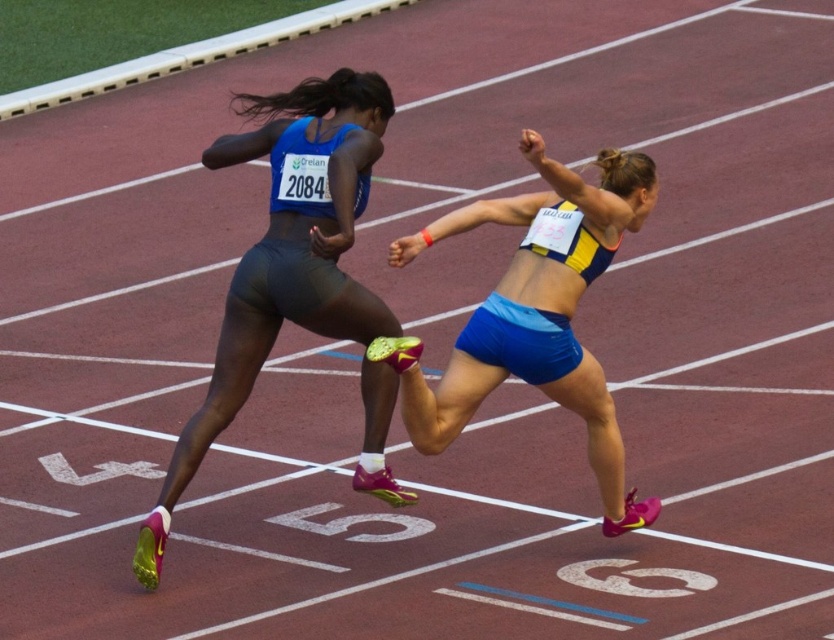
You are a photographer standing at the starting line of the track. You want to capture a photo of the athlete wearing the blue sports bra with the number 2084 pinned to her back. The camera you are using has a focal length of 50mm. Given that the athlete is at point (312,179), which is 8.23 meters away from you, what is the approximate angle of view required to ensure the athlete fits entirely within the frame?

The athlete wearing the blue sports bra with the number 2084 pinned to her back is at point (312,179) and 8.23 meters away from the photographer. To calculate the angle of view, use the formula angle of view in degrees equals arctangent of object distance divided by focal length multiplied by 57.29. Plugging in the values, arctangent of 8.23 divided by 50 times 57.29 gives approximately 52 degrees. Therefore, the photographer needs an angle of view of about 52 degrees to capture the athlete within the 50